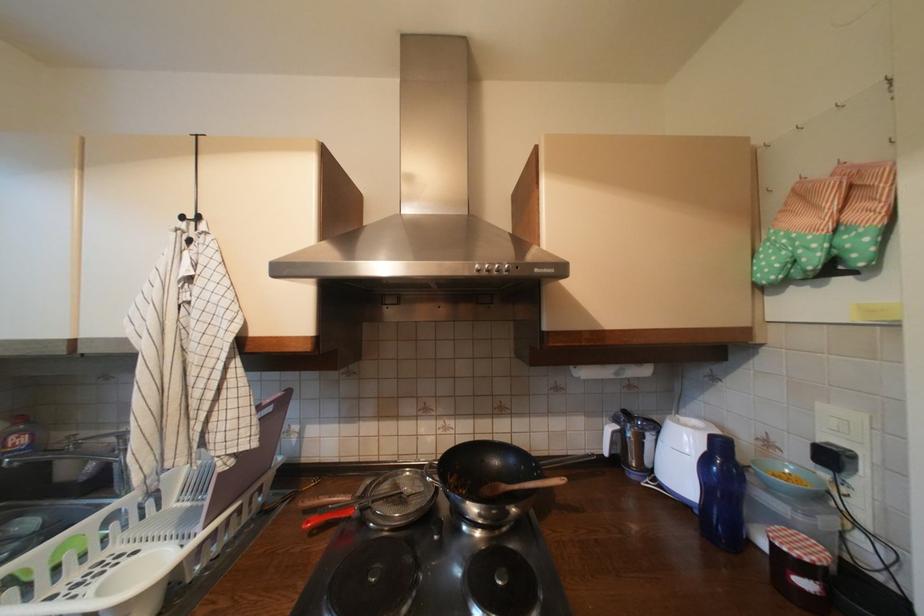
Image resolution: width=924 pixels, height=616 pixels. What do you see at coordinates (398, 499) in the screenshot? I see `the small jar lid` at bounding box center [398, 499].